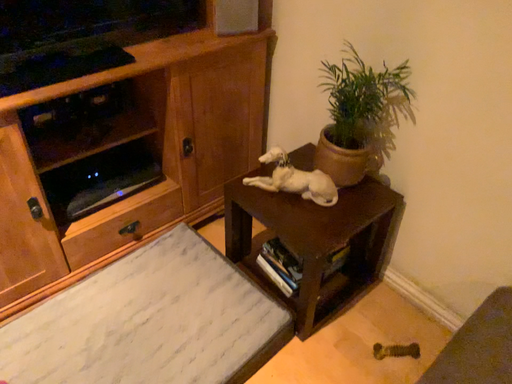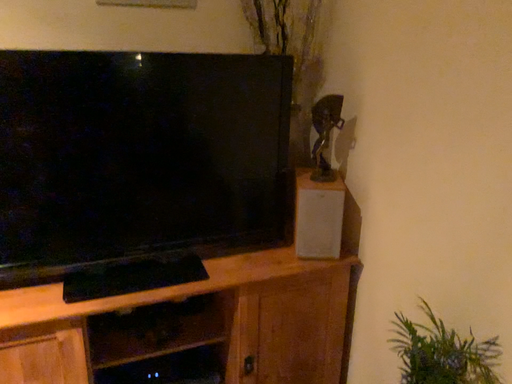
Question: Which way did the camera rotate in the video?

Choices:
 (A) rotated left
 (B) rotated right

Answer: (A)